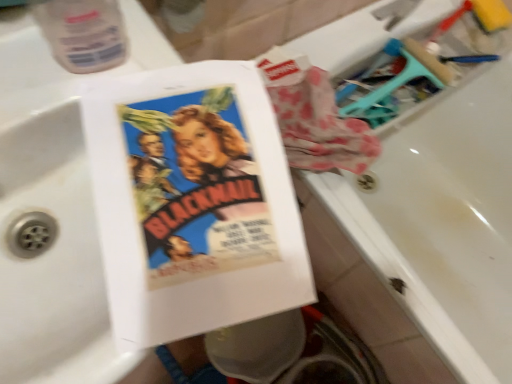
Locate an element on the screen. vacant space to the right of transparent plastic bottle at upper left is located at coordinates (176, 125).